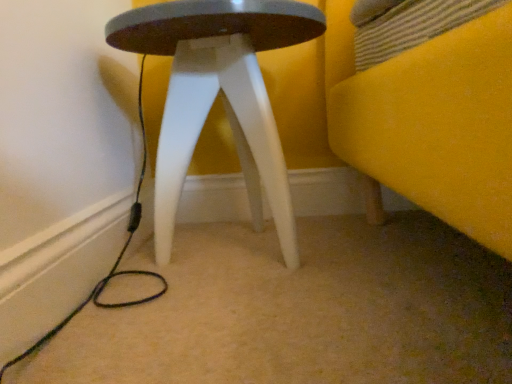
Question: Considering the positions of matte white stool at center and black cable at lower left in the image, is matte white stool at center bigger or smaller than black cable at lower left?

Choices:
 (A) big
 (B) small

Answer: (A)

Question: Based on their positions, is matte white stool at center located to the left or right of black cable at lower left?

Choices:
 (A) left
 (B) right

Answer: (B)

Question: Considering the positions of matte white stool at center and black cable at lower left in the image, is matte white stool at center wider or thinner than black cable at lower left?

Choices:
 (A) wide
 (B) thin

Answer: (A)

Question: From the image's perspective, is black cable at lower left positioned above or below matte white stool at center?

Choices:
 (A) above
 (B) below

Answer: (B)

Question: From a real-world perspective, is black cable at lower left above or below matte white stool at center?

Choices:
 (A) above
 (B) below

Answer: (B)

Question: Is point (158, 291) closer or farther from the camera than point (274, 220)?

Choices:
 (A) farther
 (B) closer

Answer: (B)

Question: Do you think black cable at lower left is within matte white stool at center, or outside of it?

Choices:
 (A) outside
 (B) inside

Answer: (A)